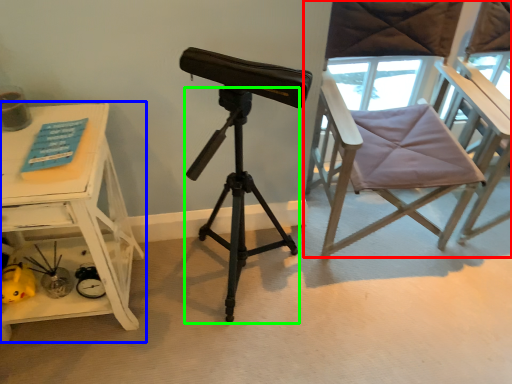
Question: Based on their relative distances, which object is farther from chair (highlighted by a red box)? Choose from table (highlighted by a blue box) and tripod (highlighted by a green box).

Choices:
 (A) table
 (B) tripod

Answer: (A)